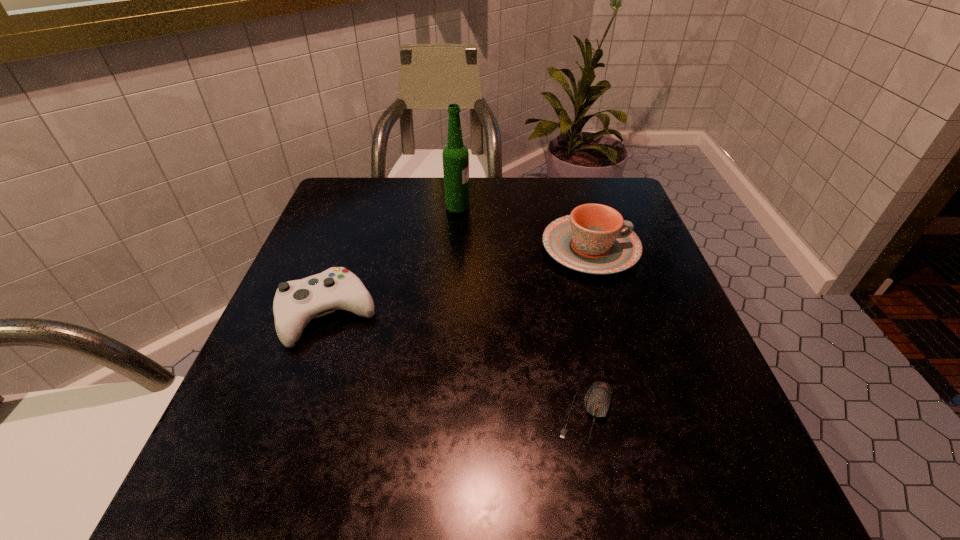
Locate an element on the screen. This screenshot has height=540, width=960. vacant region at the far right corner of the desktop is located at coordinates (621, 188).

Image resolution: width=960 pixels, height=540 pixels. In the image, there is a desktop. Identify the location of vacant space at the near right corner. (698, 507).

I want to click on free space that is in between the third tallest object and the shortest object, so click(457, 364).

You are a GUI agent. You are given a task and a screenshot of the screen. Output one action in this format:
    pyautogui.click(x=<x>, y=<y>)
    Task: Click on the free space between the chinaware and the nearest object
    
    Given the screenshot: What is the action you would take?
    pyautogui.click(x=588, y=330)

Identify the location of free space between the third shortest object and the tallest object. (524, 227).

Identify the location of vacant area between the farthest object and the chinaware. (524, 227).

This screenshot has width=960, height=540. Find the location of `free space that is in between the nearest object and the third object from right to left`. free space that is in between the nearest object and the third object from right to left is located at coordinates (521, 309).

The image size is (960, 540). What are the coordinates of `free area in between the mouse and the third shortest object` in the screenshot? It's located at (588, 330).

Where is `vacant space in between the farthest object and the control`? The width and height of the screenshot is (960, 540). vacant space in between the farthest object and the control is located at coordinates (393, 260).

Find the location of `empty space between the tallest object and the shortest object`. empty space between the tallest object and the shortest object is located at coordinates (521, 309).